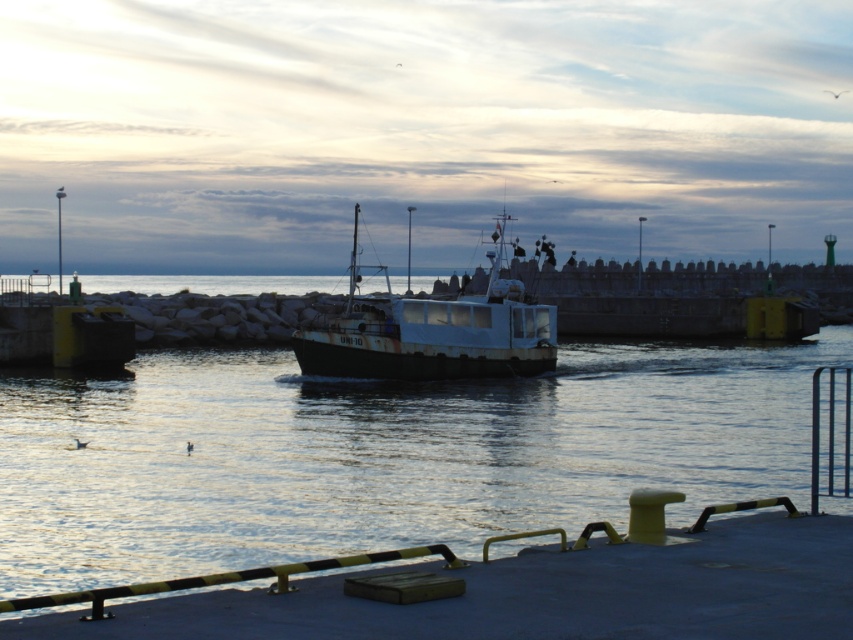
Is shiny metallic water at center positioned behind rusty metal boat at center?

No.

Does shiny metallic water at center appear on the right side of rusty metal boat at center?

In fact, shiny metallic water at center is to the left of rusty metal boat at center.

Is point (10, 564) farther from camera compared to point (550, 364)?

No, it is not.

Find the location of a particular element. shiny metallic water at center is located at coordinates (373, 456).

This screenshot has height=640, width=853. Describe the element at coordinates (544, 595) in the screenshot. I see `smooth rubber dock at lower center` at that location.

Who is more distant from viewer, (802, 566) or (521, 348)?

The point (521, 348) is behind.

Where is `smooth rubber dock at lower center`? This screenshot has height=640, width=853. smooth rubber dock at lower center is located at coordinates (544, 595).

Is point (296, 484) closer to viewer compared to point (776, 572)?

That is False.

Identify the location of shiny metallic water at center. (373, 456).

The width and height of the screenshot is (853, 640). I want to click on shiny metallic water at center, so click(373, 456).